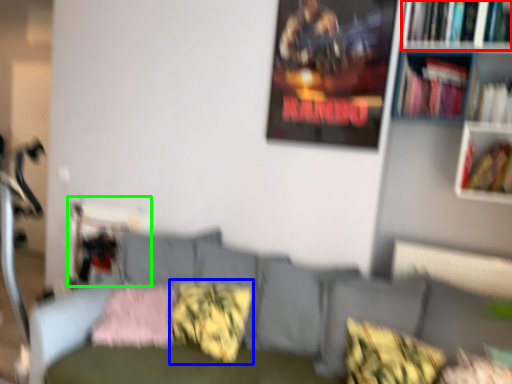
Question: Estimate the real-world distances between objects in this image. Which object is closer to book (highlighted by a red box), pillow (highlighted by a blue box) or swivel chair (highlighted by a green box)?

Choices:
 (A) pillow
 (B) swivel chair

Answer: (A)